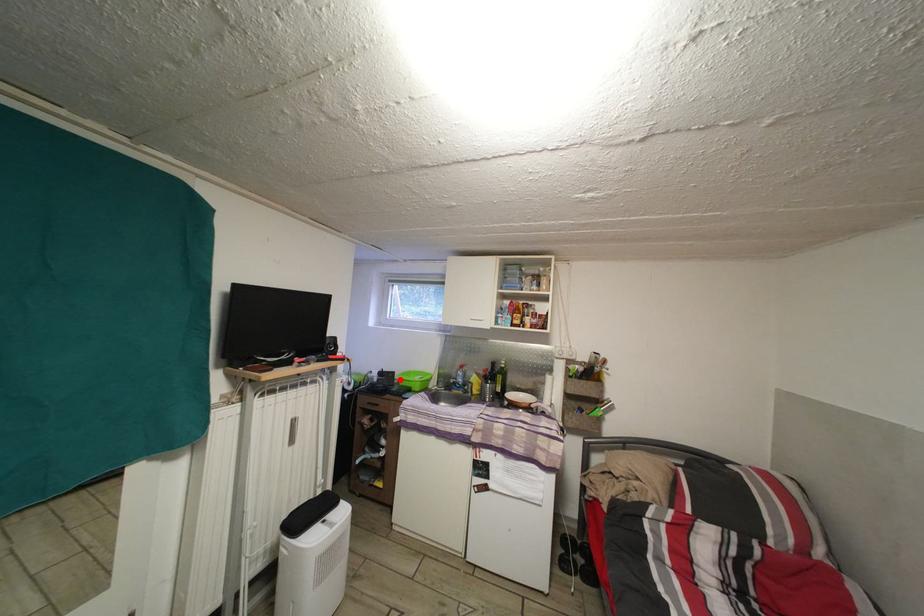
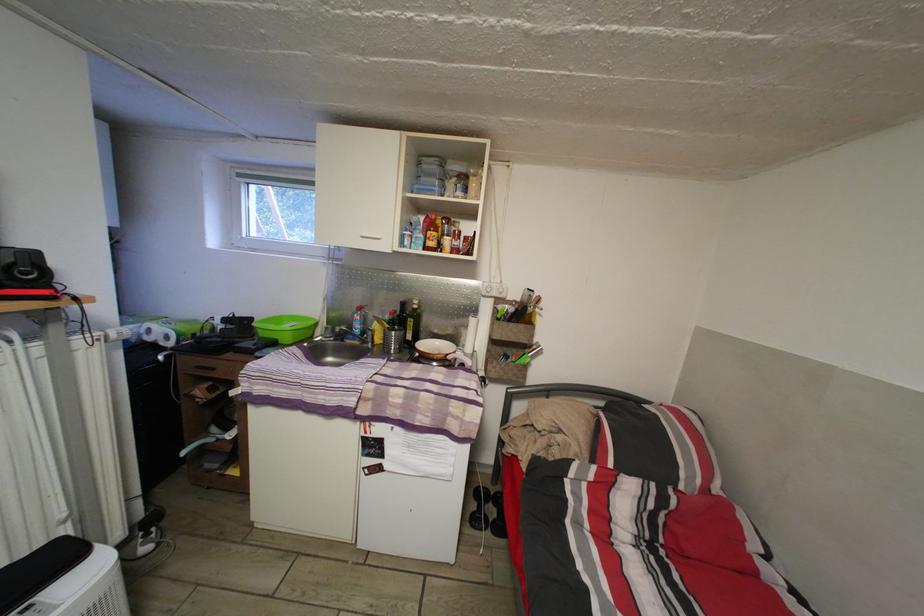
Question: I am providing you with two images of the same scene from different viewpoints. Given a red point in image1, look at the same physical point in image2. Is it:

Choices:
 (A) Closer to the viewpoint
 (B) Farther from the viewpoint

Answer: (A)